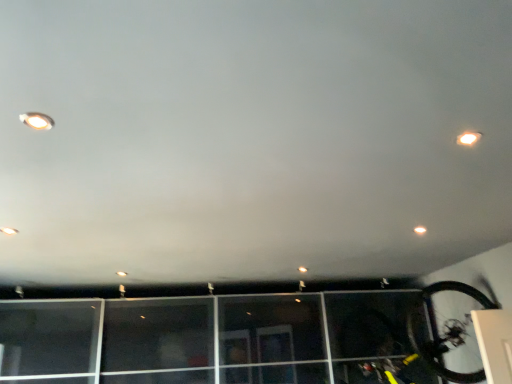
The height and width of the screenshot is (384, 512). What do you see at coordinates (420, 230) in the screenshot?
I see `matte white light at upper right` at bounding box center [420, 230].

Locate an element on the screen. This screenshot has height=384, width=512. matte white light at upper right is located at coordinates (420, 230).

Image resolution: width=512 pixels, height=384 pixels. I want to click on matte white light at upper right, so click(420, 230).